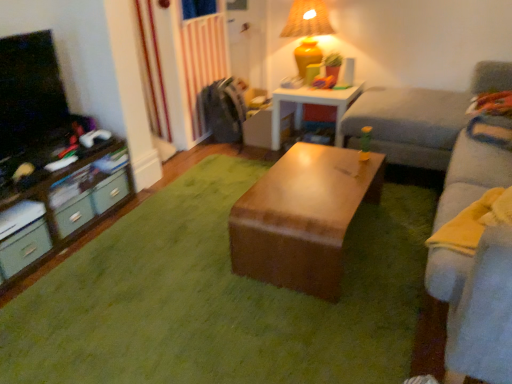
Where is `vacant space that is to the left of wooden table at center, arranged as the second table when viewed from the back`? The width and height of the screenshot is (512, 384). vacant space that is to the left of wooden table at center, arranged as the second table when viewed from the back is located at coordinates (181, 246).